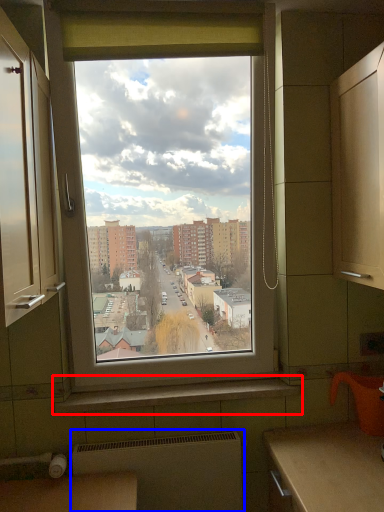
Question: Which object appears closest to the camera in this image, window sill (highlighted by a red box) or radiator (highlighted by a blue box)?

Choices:
 (A) window sill
 (B) radiator

Answer: (B)